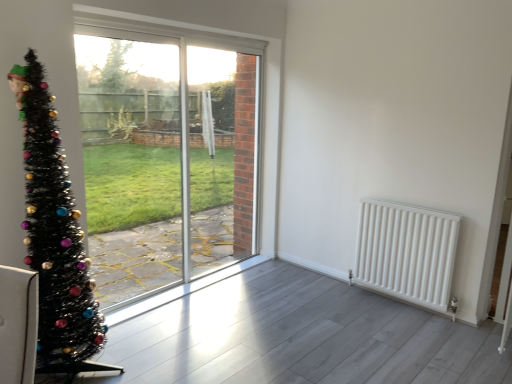
You are a GUI agent. You are given a task and a screenshot of the screen. Output one action in this format:
    pyautogui.click(x=<x>, y=<y>)
    Task: Click on the vacant area located to the right-hand side of black tinsel christmas tree at left
    The width and height of the screenshot is (512, 384).
    Given the screenshot: What is the action you would take?
    pyautogui.click(x=151, y=359)